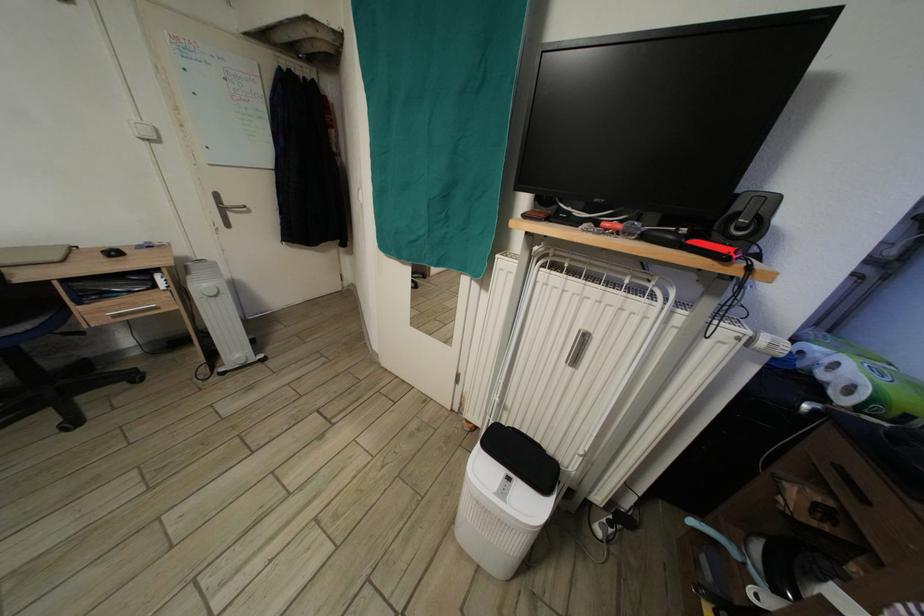
The width and height of the screenshot is (924, 616). I want to click on chair sitting surface, so click(x=23, y=314).